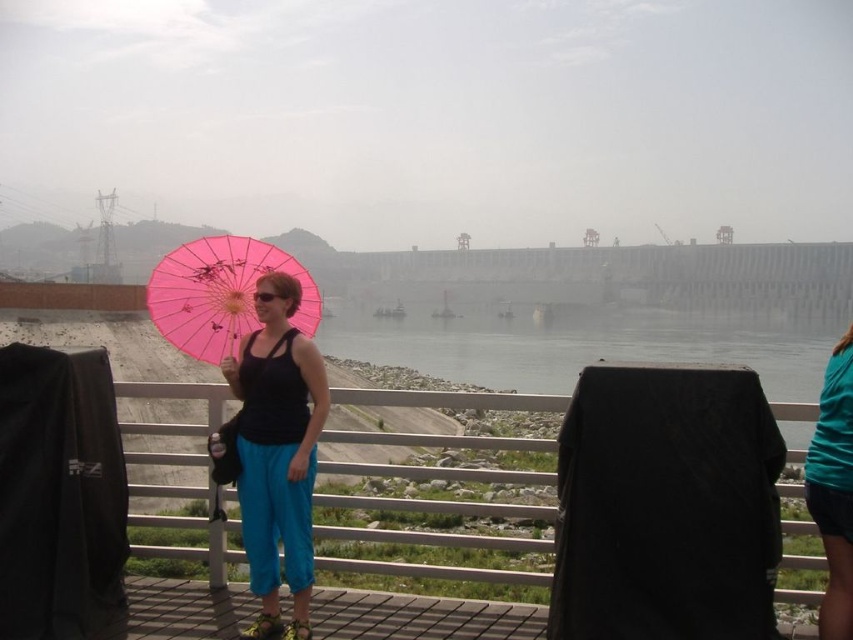
You are standing at the center of the walkway in the dam scene. You want to place a new bench exactly 0.5 meters to the right of the matte pink umbrella at left. What are the coordinates of the bench?

The coordinates of the bench would be approximately 0.706 plus 0.5 meters in the x direction, so the new coordinates would be approximately (x=277, y=639).

You are a photographer trying to capture a person under the pink paper umbrella at center while ensuring the teal fabric shirt at right is visible in the background. Can you position yourself so that the umbrella does not block the shirt?

The pink paper umbrella at center is positioned over the teal fabric shirt at right, so if you position yourself to the side or behind the umbrella, you can capture the shirt in the background without obstruction.

Based on the photo, you are a photographer trying to capture a wide shot of the pink paper umbrella at center and the teal fabric shirt at right. Since you want both objects to be clearly visible, which object should you ensure is closer to the camera to avoid being too small in the frame?

The teal fabric shirt at right should be closer to the camera because it is narrower than the pink paper umbrella at center, so positioning it closer will help it appear larger in the frame and balance the sizes of both objects.